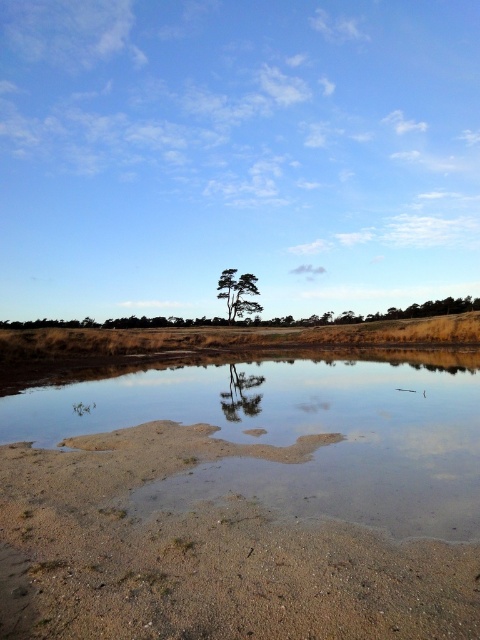
Which is behind, point (288, 588) or point (233, 307)?

Point (233, 307)

Is brown sandy dirt at lower center taller than green matte tree at center?

In fact, brown sandy dirt at lower center may be shorter than green matte tree at center.

This screenshot has width=480, height=640. Describe the element at coordinates (204, 554) in the screenshot. I see `brown sandy dirt at lower center` at that location.

Find the location of a particular element. This screenshot has height=640, width=480. brown sandy dirt at lower center is located at coordinates [204, 554].

Between point (228, 284) and point (233, 365), which one is positioned behind?

Point (228, 284)

Between green matte tree at center and smooth glass tree at center, which one is positioned higher?

green matte tree at center

Is point (226, 285) positioned behind point (240, 384)?

That is True.

Find the location of `green matte tree at center`. green matte tree at center is located at coordinates (238, 292).

Who is more distant from viewer, (456, 484) or (240, 371)?

Point (240, 371)

In the scene shown: Can you confirm if clear water at center is positioned to the left of smooth glass tree at center?

In fact, clear water at center is to the right of smooth glass tree at center.

Between point (423, 355) and point (245, 394), which one is positioned behind?

Positioned behind is point (423, 355).

Where is `clear water at center`? clear water at center is located at coordinates (300, 435).